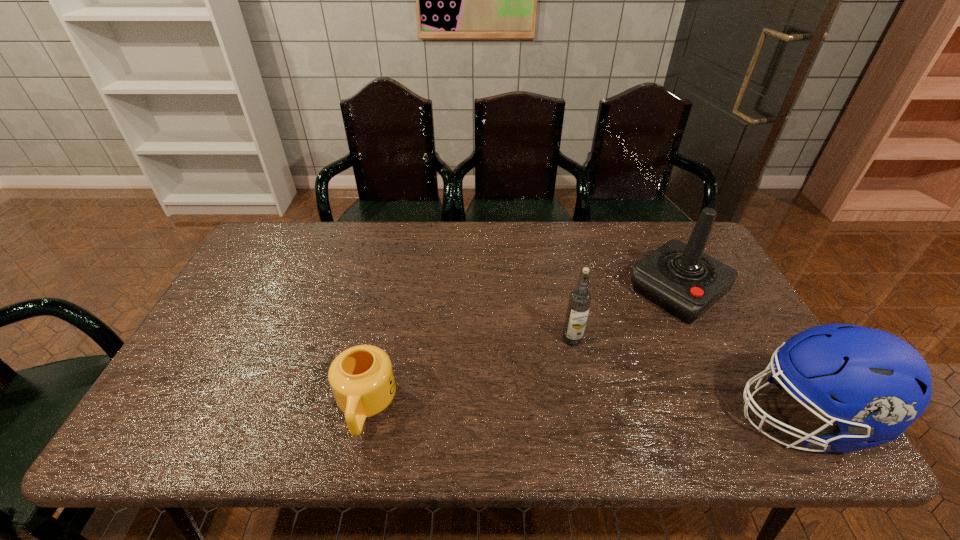
Find the location of a particular element. This screenshot has width=960, height=540. vacant area situated 0.190m on the label of the second farthest object is located at coordinates (529, 396).

In order to click on free space located on the label of the second farthest object in this screenshot , I will do `click(550, 368)`.

Identify the location of object that is at the far edge. This screenshot has height=540, width=960. (681, 279).

Image resolution: width=960 pixels, height=540 pixels. In order to click on mug located at the near edge in this screenshot , I will do `click(362, 380)`.

Where is `football helmet positioned at the near edge`? The image size is (960, 540). football helmet positioned at the near edge is located at coordinates (882, 384).

You are a GUI agent. You are given a task and a screenshot of the screen. Output one action in this format:
    pyautogui.click(x=<x>, y=<y>)
    Task: Click on the football helmet located at the right edge
    
    Given the screenshot: What is the action you would take?
    pyautogui.click(x=882, y=384)

Image resolution: width=960 pixels, height=540 pixels. I want to click on joystick at the right edge, so point(681,279).

Image resolution: width=960 pixels, height=540 pixels. Identify the location of object located at the far right corner. (681, 279).

Identify the location of object that is positioned at the near right corner. (882, 384).

Identify the location of vacant space at the far edge of the desktop. (577, 246).